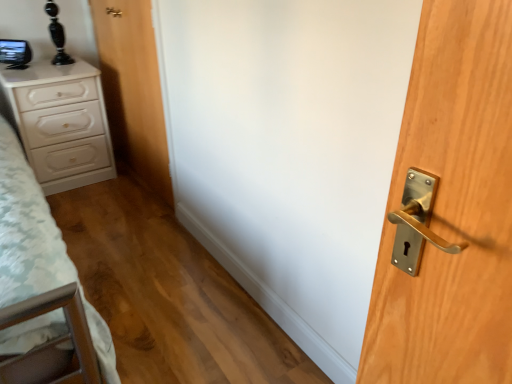
What do you see at coordinates (61, 123) in the screenshot? I see `white glossy chest of drawers at left` at bounding box center [61, 123].

This screenshot has height=384, width=512. I want to click on white glossy chest of drawers at left, so click(x=61, y=123).

Identify the location of wooden door at center. (133, 89).

The height and width of the screenshot is (384, 512). What do you see at coordinates (133, 89) in the screenshot?
I see `wooden door at center` at bounding box center [133, 89].

You are a GUI agent. You are given a task and a screenshot of the screen. Output one action in this format:
    pyautogui.click(x=<x>, y=<y>)
    Task: Click on the white glossy chest of drawers at left
    The image size is (512, 384).
    Given the screenshot: What is the action you would take?
    pyautogui.click(x=61, y=123)

In the image, is wooden door at center on the left side or the right side of white glossy chest of drawers at left?

Clearly, wooden door at center is on the right of white glossy chest of drawers at left in the image.

In the image, is wooden door at center positioned in front of or behind white glossy chest of drawers at left?

wooden door at center is in front of white glossy chest of drawers at left.

Does point (162, 110) come closer to viewer compared to point (71, 91)?

Yes.

From the image's perspective, is wooden door at center positioned above or below white glossy chest of drawers at left?

wooden door at center is above white glossy chest of drawers at left.

From a real-world perspective, is wooden door at center positioned above or below white glossy chest of drawers at left?

In terms of real-world spatial position, wooden door at center is above white glossy chest of drawers at left.

Does wooden door at center have a greater width compared to white glossy chest of drawers at left?

Incorrect, the width of wooden door at center does not surpass that of white glossy chest of drawers at left.

Consider the image. Considering the relative sizes of wooden door at center and white glossy chest of drawers at left in the image provided, is wooden door at center taller than white glossy chest of drawers at left?

Indeed, wooden door at center has a greater height compared to white glossy chest of drawers at left.

Considering the sizes of objects wooden door at center and white glossy chest of drawers at left in the image provided, who is smaller, wooden door at center or white glossy chest of drawers at left?

Smaller between the two is wooden door at center.

Is white glossy chest of drawers at left completely or partially inside wooden door at center?

No, wooden door at center does not contain white glossy chest of drawers at left.

Are wooden door at center and white glossy chest of drawers at left making contact?

No, wooden door at center is not making contact with white glossy chest of drawers at left.

Is wooden door at center positioned with its back to white glossy chest of drawers at left?

Absolutely, wooden door at center is directed away from white glossy chest of drawers at left.

Based on the photo, how many degrees apart are the facing directions of wooden door at center and white glossy chest of drawers at left?

wooden door at center and white glossy chest of drawers at left are facing 91.7 degrees away from each other.

Locate an element on the screen. The height and width of the screenshot is (384, 512). door above the white glossy chest of drawers at left (from the image's perspective) is located at coordinates click(x=133, y=89).

Visually, is white glossy chest of drawers at left positioned to the left or to the right of wooden door at center?

Clearly, white glossy chest of drawers at left is on the left of wooden door at center in the image.

Considering the positions of objects white glossy chest of drawers at left and wooden door at center in the image provided, who is in front, white glossy chest of drawers at left or wooden door at center?

wooden door at center is more forward.

Is point (31, 149) positioned in front of point (160, 152)?

That is False.

From the image's perspective, which object appears higher, white glossy chest of drawers at left or wooden door at center?

wooden door at center.

From a real-world perspective, which is physically below, white glossy chest of drawers at left or wooden door at center?

From a 3D spatial view, white glossy chest of drawers at left is below.

Considering the sizes of white glossy chest of drawers at left and wooden door at center in the image, is white glossy chest of drawers at left wider or thinner than wooden door at center?

In the image, white glossy chest of drawers at left appears to be wider than wooden door at center.

Can you confirm if white glossy chest of drawers at left is shorter than wooden door at center?

Indeed, white glossy chest of drawers at left has a lesser height compared to wooden door at center.

Can you confirm if white glossy chest of drawers at left is bigger than wooden door at center?

Yes.

Is white glossy chest of drawers at left inside or outside of wooden door at center?

white glossy chest of drawers at left exists outside the volume of wooden door at center.

Based on the photo, is the surface of white glossy chest of drawers at left in direct contact with wooden door at center?

No, white glossy chest of drawers at left is not with wooden door at center.

Is white glossy chest of drawers at left facing away from wooden door at center?

No.

Can you tell me how much white glossy chest of drawers at left and wooden door at center differ in facing direction?

91.7 degrees separate the facing orientations of white glossy chest of drawers at left and wooden door at center.

Find the location of a particular element. The image size is (512, 384). the chest of drawers directly beneath the wooden door at center (from a real-world perspective) is located at coordinates (61, 123).

You are a GUI agent. You are given a task and a screenshot of the screen. Output one action in this format:
    pyautogui.click(x=<x>, y=<y>)
    Task: Click on the chest of drawers located below the wooden door at center (from the image's perspective)
    
    Given the screenshot: What is the action you would take?
    pyautogui.click(x=61, y=123)

Locate an element on the screen. The height and width of the screenshot is (384, 512). door on the right side of white glossy chest of drawers at left is located at coordinates point(133,89).